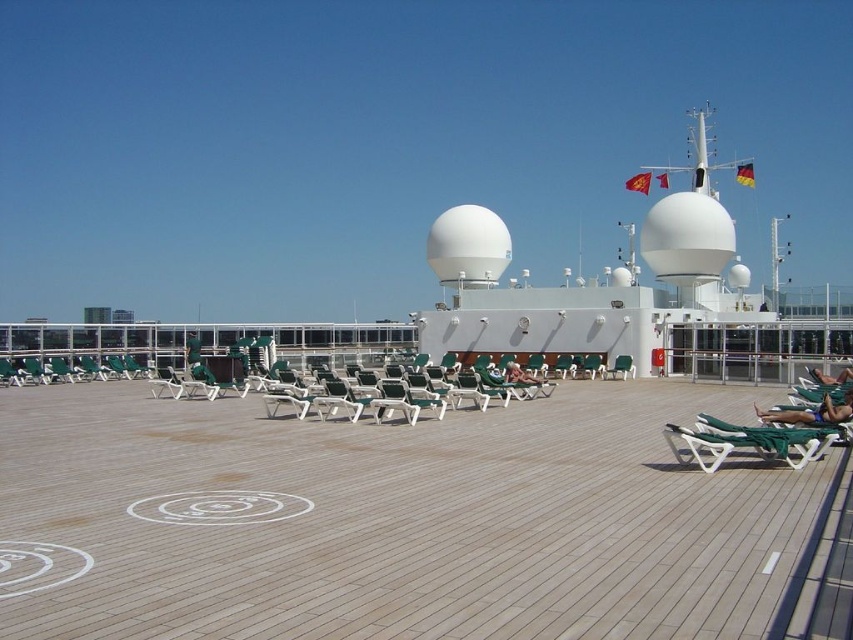
Question: Where is green fabric chair at center located in relation to tan skin person at lower right in the image?

Choices:
 (A) right
 (B) left

Answer: (B)

Question: Estimate the real-world distances between objects in this image. Which object is closer to the blue fabric person at lower right?

Choices:
 (A) tan skin person at lower right
 (B) green fabric chair at center

Answer: (A)

Question: Observing the image, what is the correct spatial positioning of green fabric chair at center in reference to green plastic beach chair at center?

Choices:
 (A) left
 (B) right

Answer: (A)

Question: Which point is closer to the camera?

Choices:
 (A) (833, 404)
 (B) (511, 364)

Answer: (A)

Question: Does wooden deck at center appear on the right side of tan skin person at lower right?

Choices:
 (A) no
 (B) yes

Answer: (A)

Question: Which object appears closest to the camera in this image?

Choices:
 (A) tan skin person at lower right
 (B) green fabric chair at center

Answer: (A)